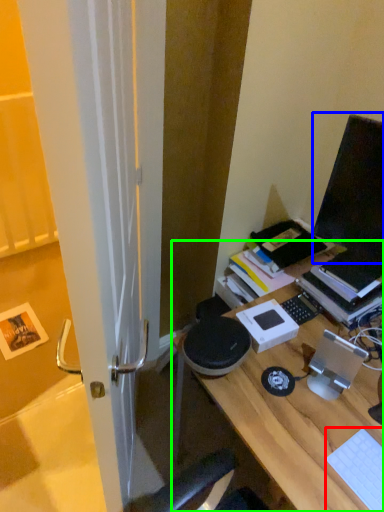
Question: Which object is positioned closest to laptop keyboard (highlighted by a red box)? Select from computer monitor (highlighted by a blue box) and desk (highlighted by a green box).

Choices:
 (A) computer monitor
 (B) desk

Answer: (B)